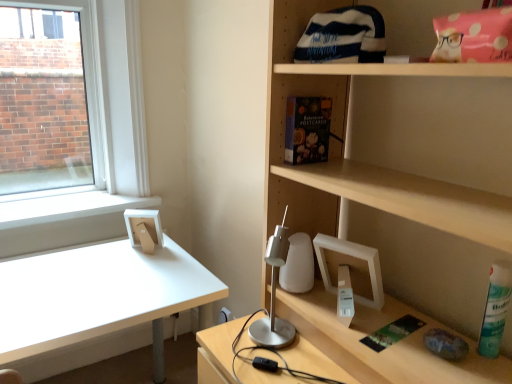
Question: Is matte floral-patterned book at upper center thinner than white matte desk at left?

Choices:
 (A) yes
 (B) no

Answer: (A)

Question: Considering the relative sizes of matte floral-patterned book at upper center and white matte desk at left in the image provided, is matte floral-patterned book at upper center taller than white matte desk at left?

Choices:
 (A) yes
 (B) no

Answer: (B)

Question: Can you confirm if matte floral-patterned book at upper center is positioned to the right of white matte desk at left?

Choices:
 (A) no
 (B) yes

Answer: (B)

Question: From the image's perspective, is matte floral-patterned book at upper center located beneath white matte desk at left?

Choices:
 (A) yes
 (B) no

Answer: (B)

Question: Is matte floral-patterned book at upper center wider than white matte desk at left?

Choices:
 (A) yes
 (B) no

Answer: (B)

Question: Does matte floral-patterned book at upper center turn towards white matte desk at left?

Choices:
 (A) yes
 (B) no

Answer: (B)

Question: Is matte floral-patterned book at upper center to the right of green matte spray can at lower right from the viewer's perspective?

Choices:
 (A) yes
 (B) no

Answer: (B)

Question: Is matte floral-patterned book at upper center turned away from green matte spray can at lower right?

Choices:
 (A) no
 (B) yes

Answer: (A)

Question: From a real-world perspective, is matte floral-patterned book at upper center physically above green matte spray can at lower right?

Choices:
 (A) yes
 (B) no

Answer: (A)

Question: Does matte floral-patterned book at upper center come in front of green matte spray can at lower right?

Choices:
 (A) no
 (B) yes

Answer: (A)

Question: Can you confirm if matte floral-patterned book at upper center is shorter than green matte spray can at lower right?

Choices:
 (A) yes
 (B) no

Answer: (A)

Question: Is matte floral-patterned book at upper center outside green matte spray can at lower right?

Choices:
 (A) no
 (B) yes

Answer: (B)

Question: Considering the relative positions of green matte spray can at lower right and matte floral-patterned book at upper center in the image provided, is green matte spray can at lower right to the left of matte floral-patterned book at upper center from the viewer's perspective?

Choices:
 (A) yes
 (B) no

Answer: (B)